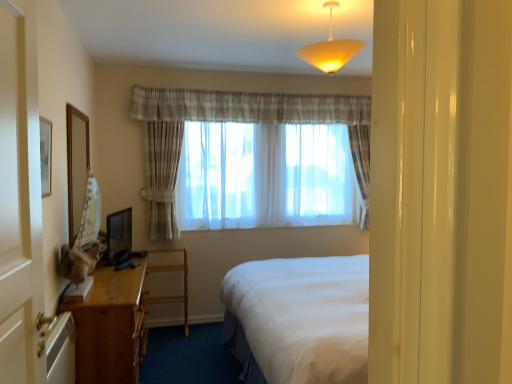
Question: In terms of size, does matte yellow glass lampshade at upper center appear bigger or smaller than wooden desk at lower left?

Choices:
 (A) big
 (B) small

Answer: (B)

Question: From a real-world perspective, is matte yellow glass lampshade at upper center positioned above or below wooden desk at lower left?

Choices:
 (A) below
 (B) above

Answer: (B)

Question: Which of these objects is positioned closest to the wooden desk at lower left?

Choices:
 (A) sheer fabric curtains at center
 (B) wooden mirror at left
 (C) wooden desk at left
 (D) white wood screen door at left
 (E) matte yellow glass lampshade at upper center

Answer: (A)

Question: Considering the real-world distances, which object is farthest from the wooden desk at left?

Choices:
 (A) white wood screen door at left
 (B) wooden desk at lower left
 (C) wooden mirror at left
 (D) sheer fabric curtains at center
 (E) matte yellow glass lampshade at upper center

Answer: (E)